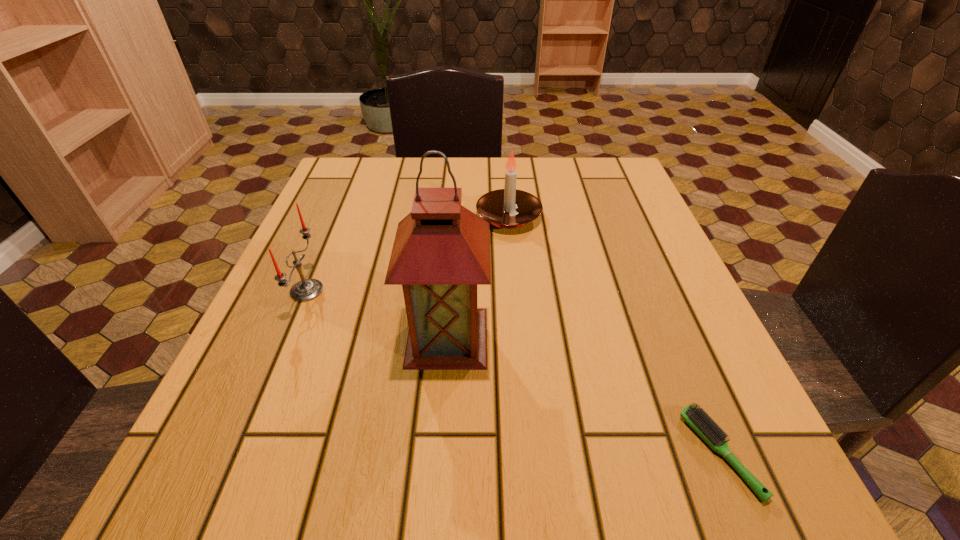
The width and height of the screenshot is (960, 540). In order to click on lantern in this screenshot , I will do `click(441, 252)`.

At what (x,y) coordinates should I click in order to perform the action: click on the farthest object. Please return your answer as a coordinate pair (x, y). The height and width of the screenshot is (540, 960). Looking at the image, I should click on (508, 208).

This screenshot has height=540, width=960. I want to click on the farther candle, so click(508, 208).

I want to click on the leftmost object, so click(305, 290).

Identify the location of the left candle. (305, 290).

Locate an element on the screen. The image size is (960, 540). the rightmost object is located at coordinates (697, 418).

I want to click on hairbrush, so tap(697, 418).

Where is `free region located on the back of the lantern`? free region located on the back of the lantern is located at coordinates (453, 251).

Find the location of a particular element. free space located on the front of the farther candle is located at coordinates (521, 366).

You are a GUI agent. You are given a task and a screenshot of the screen. Output one action in this format:
    pyautogui.click(x=<x>, y=<y>)
    Task: Click on the vacant area situated 0.080m on the front-facing side of the leftmost object
    
    Given the screenshot: What is the action you would take?
    pyautogui.click(x=366, y=291)